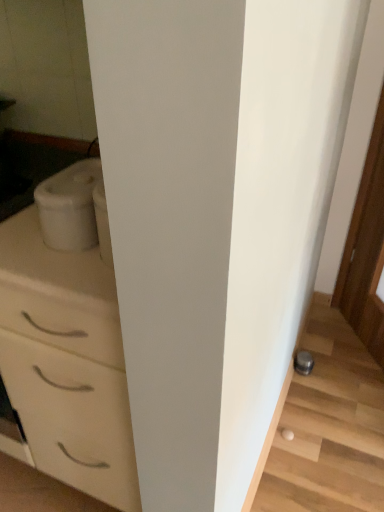
Question: Does metallic gray stairwell at lower right have a greater height compared to white matte container at left?

Choices:
 (A) no
 (B) yes

Answer: (A)

Question: Can you confirm if metallic gray stairwell at lower right is shorter than white matte container at left?

Choices:
 (A) no
 (B) yes

Answer: (B)

Question: From the image's perspective, would you say metallic gray stairwell at lower right is positioned over white matte container at left?

Choices:
 (A) yes
 (B) no

Answer: (B)

Question: From a real-world perspective, is metallic gray stairwell at lower right over white matte container at left?

Choices:
 (A) yes
 (B) no

Answer: (B)

Question: Does metallic gray stairwell at lower right touch white matte container at left?

Choices:
 (A) no
 (B) yes

Answer: (A)

Question: Considering their positions, is white glossy chest of drawers at left located in front of or behind white matte container at left?

Choices:
 (A) front
 (B) behind

Answer: (A)

Question: In terms of size, does white glossy chest of drawers at left appear bigger or smaller than white matte container at left?

Choices:
 (A) big
 (B) small

Answer: (A)

Question: Visually, is white glossy chest of drawers at left positioned to the left or to the right of white matte container at left?

Choices:
 (A) right
 (B) left

Answer: (B)

Question: Is white glossy chest of drawers at left wider or thinner than white matte container at left?

Choices:
 (A) wide
 (B) thin

Answer: (A)

Question: Looking at their shapes, would you say white glossy chest of drawers at left is wider or thinner than metallic gray stairwell at lower right?

Choices:
 (A) thin
 (B) wide

Answer: (B)

Question: From a real-world perspective, is white glossy chest of drawers at left positioned above or below metallic gray stairwell at lower right?

Choices:
 (A) below
 (B) above

Answer: (B)

Question: From the image's perspective, is white glossy chest of drawers at left located above or below metallic gray stairwell at lower right?

Choices:
 (A) below
 (B) above

Answer: (B)

Question: Is white glossy chest of drawers at left to the left or to the right of metallic gray stairwell at lower right in the image?

Choices:
 (A) left
 (B) right

Answer: (A)

Question: Is white matte container at left taller or shorter than metallic gray stairwell at lower right?

Choices:
 (A) tall
 (B) short

Answer: (A)

Question: Does point (69, 188) appear closer or farther from the camera than point (301, 436)?

Choices:
 (A) farther
 (B) closer

Answer: (B)